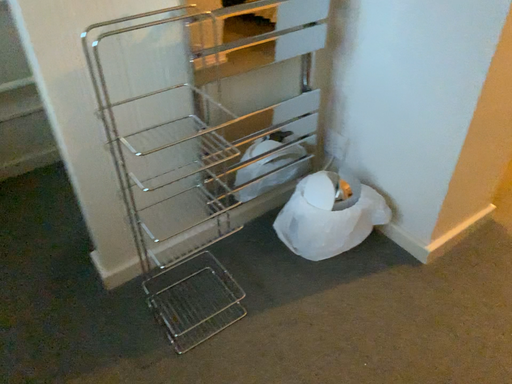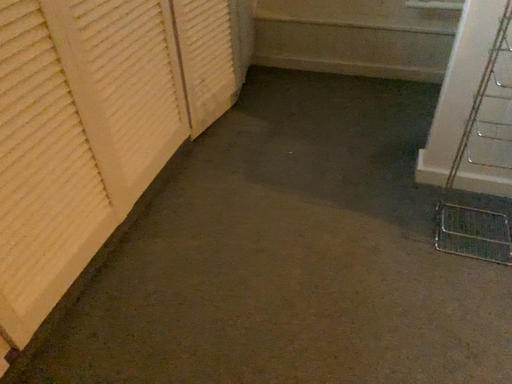
Question: How did the camera likely rotate when shooting the video?

Choices:
 (A) rotated left
 (B) rotated right

Answer: (A)